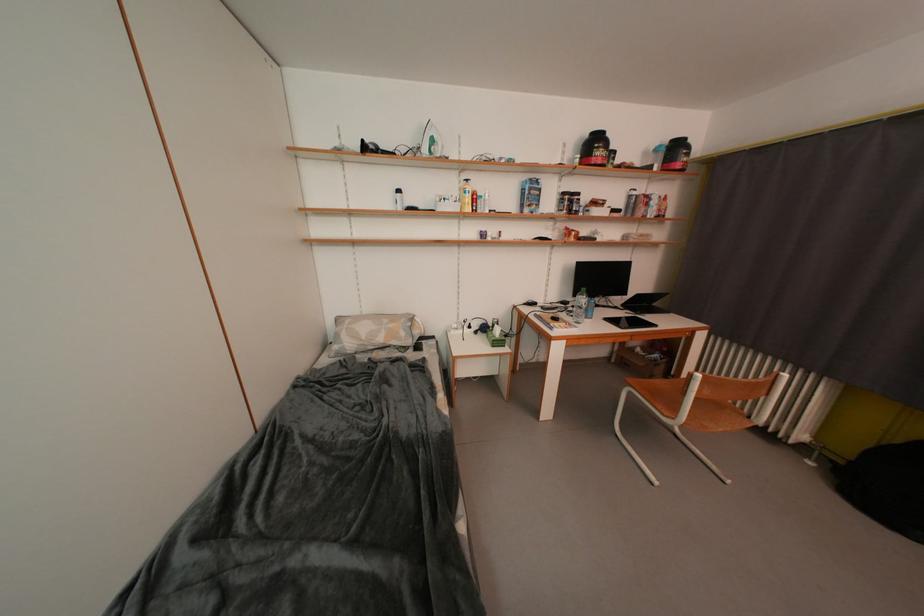
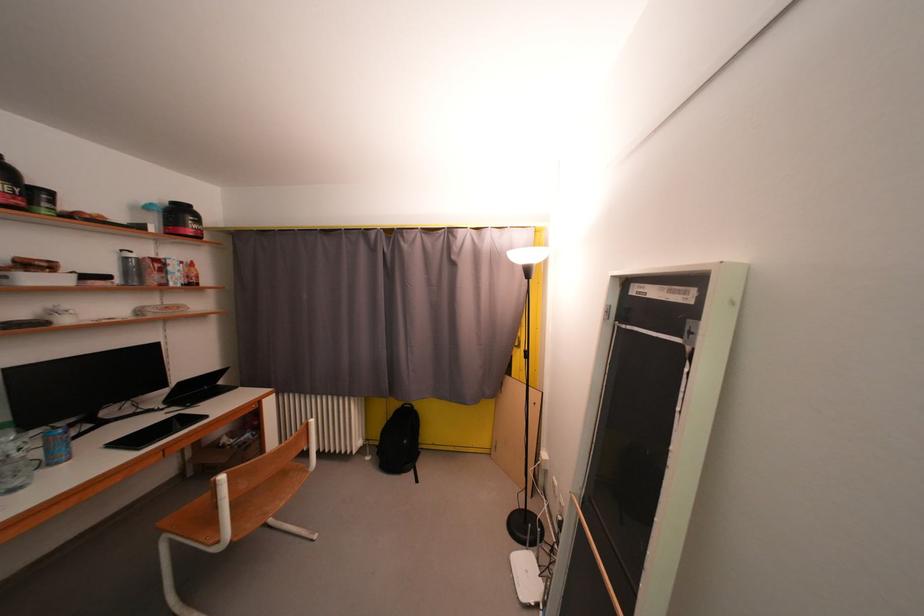
Question: The first image is from the beginning of the video and the second image is from the end. How did the camera likely rotate when shooting the video?

Choices:
 (A) Left
 (B) Right
 (C) Up
 (D) Down

Answer: (B)